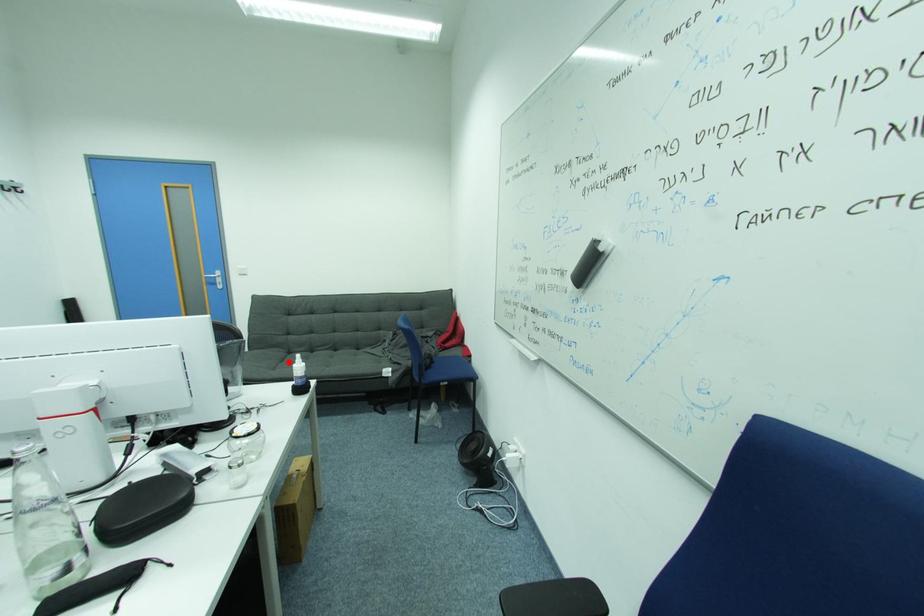
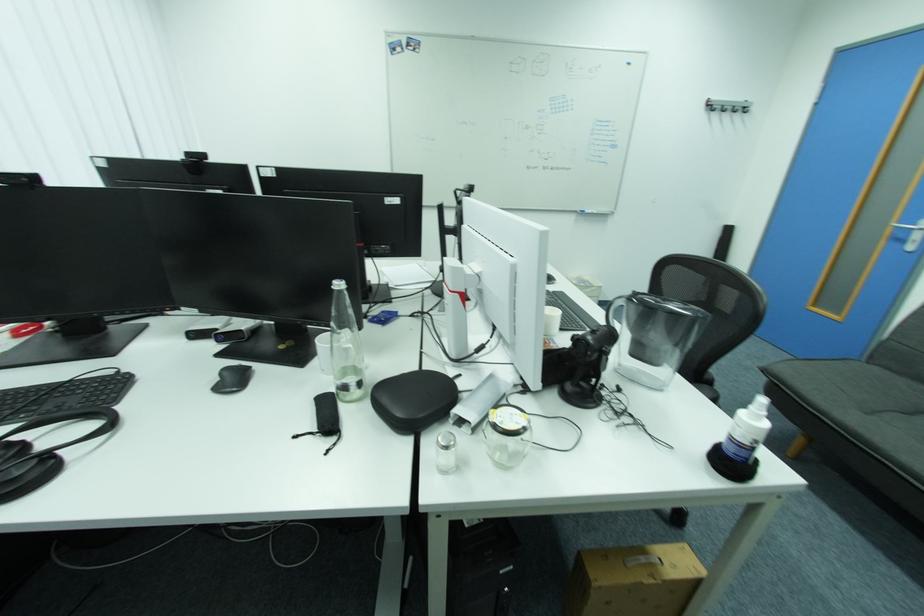
Question: I am providing you with two images of the same scene from different viewpoints. Given a red point in image1, look at the same physical point in image2. Is it:

Choices:
 (A) Closer to the viewpoint
 (B) Farther from the viewpoint

Answer: (B)